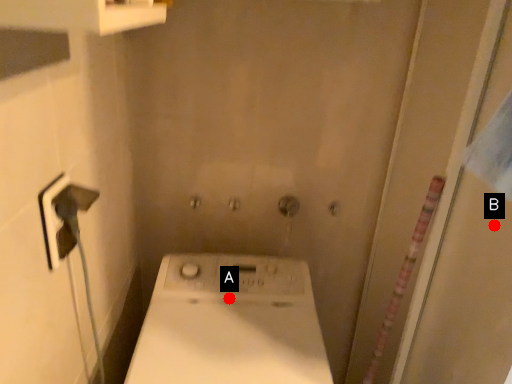
Question: Two points are circled on the image, labeled by A and B beside each circle. Which point appears closest to the camera in this image?

Choices:
 (A) A is closer
 (B) B is closer

Answer: (B)